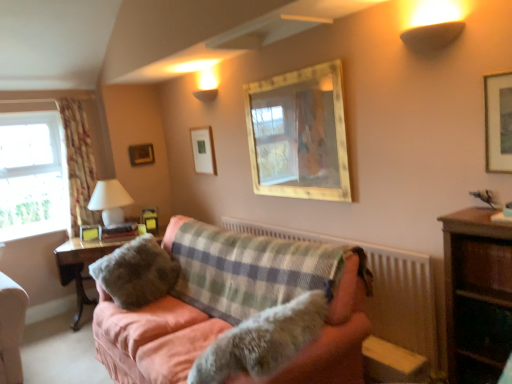
You are a GUI agent. You are given a task and a screenshot of the screen. Output one action in this format:
    pyautogui.click(x=<x>, y=<y>)
    Task: Click on the blank space above gold textured mirror at upper center, which is the 2th picture frame from right to left (from a real-world perspective)
    The width and height of the screenshot is (512, 384).
    Given the screenshot: What is the action you would take?
    tap(292, 68)